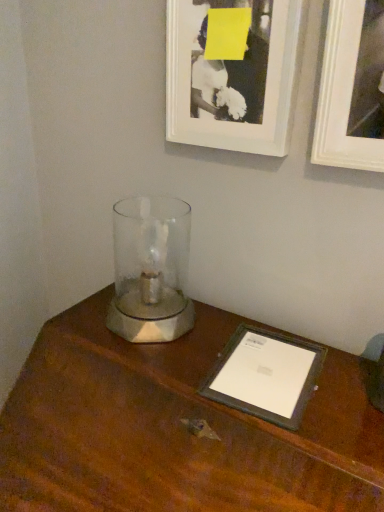
The height and width of the screenshot is (512, 384). I want to click on brown wood table at center, so click(176, 429).

I want to click on black matte picture frame at upper center, the 1th picture frame viewed from the left, so click(x=232, y=73).

Where is `brown wood table at center`? brown wood table at center is located at coordinates (176, 429).

From the image's perspective, which object appears higher, black matte picture frame at upper center, placed as the 2th picture frame when sorted from right to left, or brown wood table at center?

black matte picture frame at upper center, placed as the 2th picture frame when sorted from right to left, from the image's perspective.

Starting from the brown wood table at center, which picture frame is the 2nd one behind? Please provide its 2D coordinates.

[(232, 73)]

Considering their positions, is black matte picture frame at upper center, placed as the 2th picture frame when sorted from right to left, located in front of or behind brown wood table at center?

black matte picture frame at upper center, placed as the 2th picture frame when sorted from right to left, is positioned farther from the viewer than brown wood table at center.

Which of these two, white matte picture frame at upper right, acting as the 2th picture frame starting from the left, or black matte picture frame at upper center, the 1th picture frame viewed from the left, is smaller?

Smaller between the two is black matte picture frame at upper center, the 1th picture frame viewed from the left.

Is there a large distance between white matte picture frame at upper right, the 1th picture frame in the right-to-left sequence, and black matte picture frame at upper center, the 1th picture frame viewed from the left?

No, white matte picture frame at upper right, the 1th picture frame in the right-to-left sequence, is in close proximity to black matte picture frame at upper center, the 1th picture frame viewed from the left.

At what (x,y) coordinates should I click in order to perform the action: click on picture frame below the black matte picture frame at upper center, placed as the 2th picture frame when sorted from right to left (from the image's perspective). Please return your answer as a coordinate pair (x, y). This screenshot has height=512, width=384. Looking at the image, I should click on (351, 88).

Is brown wood table at center placed right next to white matte picture frame at upper right, acting as the 2th picture frame starting from the left?

No.

Can you confirm if brown wood table at center is positioned to the right of white matte picture frame at upper right, the 1th picture frame in the right-to-left sequence?

No, brown wood table at center is not to the right of white matte picture frame at upper right, the 1th picture frame in the right-to-left sequence.

How different are the orientations of brown wood table at center and white matte picture frame at upper right, the 1th picture frame in the right-to-left sequence, in degrees?

brown wood table at center and white matte picture frame at upper right, the 1th picture frame in the right-to-left sequence, are facing 3.24 degrees away from each other.

Where is `the 2nd picture frame to the right of the brown wood table at center, starting your count from the anchor`? The image size is (384, 512). the 2nd picture frame to the right of the brown wood table at center, starting your count from the anchor is located at coordinates (351, 88).

In terms of size, does white matte picture frame at upper right, acting as the 2th picture frame starting from the left, appear bigger or smaller than brown wood table at center?

Clearly, white matte picture frame at upper right, acting as the 2th picture frame starting from the left, is smaller in size than brown wood table at center.

Which is in front, white matte picture frame at upper right, the 1th picture frame in the right-to-left sequence, or brown wood table at center?

brown wood table at center.

You are a GUI agent. You are given a task and a screenshot of the screen. Output one action in this format:
    pyautogui.click(x=<x>, y=<y>)
    Task: Click on the picture frame in front of the black matte picture frame at upper center, the 1th picture frame viewed from the left
    The width and height of the screenshot is (384, 512).
    Given the screenshot: What is the action you would take?
    pyautogui.click(x=351, y=88)

From a real-world perspective, is black matte picture frame at upper center, placed as the 2th picture frame when sorted from right to left, located higher than white matte picture frame at upper right, the 1th picture frame in the right-to-left sequence?

No.

Who is more distant, black matte picture frame at upper center, placed as the 2th picture frame when sorted from right to left, or white matte picture frame at upper right, acting as the 2th picture frame starting from the left?

Positioned behind is black matte picture frame at upper center, placed as the 2th picture frame when sorted from right to left.

Between black matte picture frame at upper center, the 1th picture frame viewed from the left, and white matte picture frame at upper right, the 1th picture frame in the right-to-left sequence, which one has more height?

With more height is white matte picture frame at upper right, the 1th picture frame in the right-to-left sequence.

Is brown wood table at center bigger than black matte picture frame at upper center, the 1th picture frame viewed from the left?

Correct, brown wood table at center is larger in size than black matte picture frame at upper center, the 1th picture frame viewed from the left.

Between brown wood table at center and black matte picture frame at upper center, the 1th picture frame viewed from the left, which one has more height?

brown wood table at center.

Considering the sizes of objects brown wood table at center and black matte picture frame at upper center, the 1th picture frame viewed from the left, in the image provided, who is wider, brown wood table at center or black matte picture frame at upper center, the 1th picture frame viewed from the left,?

brown wood table at center.

Which object is closer to the camera taking this photo, brown wood table at center or black matte picture frame at upper center, placed as the 2th picture frame when sorted from right to left?

brown wood table at center is more forward.

The image size is (384, 512). Find the location of `table in front of the black matte picture frame at upper center, placed as the 2th picture frame when sorted from right to left`. table in front of the black matte picture frame at upper center, placed as the 2th picture frame when sorted from right to left is located at coordinates (176, 429).

Identify the location of picture frame that appears below the black matte picture frame at upper center, the 1th picture frame viewed from the left (from the image's perspective). (351, 88).

From the picture: Looking at the image, which one is located further to brown wood table at center, black matte picture frame at upper center, placed as the 2th picture frame when sorted from right to left, or white matte picture frame at upper right, acting as the 2th picture frame starting from the left?

Based on the image, white matte picture frame at upper right, acting as the 2th picture frame starting from the left, appears to be further to brown wood table at center.

From the image, which object appears to be nearer to black matte picture frame at upper center, placed as the 2th picture frame when sorted from right to left, brown wood table at center or white matte picture frame at upper right, acting as the 2th picture frame starting from the left?

white matte picture frame at upper right, acting as the 2th picture frame starting from the left, is positioned closer to the anchor black matte picture frame at upper center, placed as the 2th picture frame when sorted from right to left.

Based on their spatial positions, is white matte picture frame at upper right, the 1th picture frame in the right-to-left sequence, or brown wood table at center further from black matte picture frame at upper center, placed as the 2th picture frame when sorted from right to left?

brown wood table at center.

Which object lies further to the anchor point white matte picture frame at upper right, acting as the 2th picture frame starting from the left, black matte picture frame at upper center, placed as the 2th picture frame when sorted from right to left, or brown wood table at center?

Among the two, brown wood table at center is located further to white matte picture frame at upper right, acting as the 2th picture frame starting from the left.

Considering their positions, is brown wood table at center positioned closer to white matte picture frame at upper right, the 1th picture frame in the right-to-left sequence, than black matte picture frame at upper center, placed as the 2th picture frame when sorted from right to left?

black matte picture frame at upper center, placed as the 2th picture frame when sorted from right to left, lies closer to white matte picture frame at upper right, the 1th picture frame in the right-to-left sequence, than the other object.

Looking at the image, which one is located closer to brown wood table at center, white matte picture frame at upper right, the 1th picture frame in the right-to-left sequence, or black matte picture frame at upper center, placed as the 2th picture frame when sorted from right to left?

The object closer to brown wood table at center is black matte picture frame at upper center, placed as the 2th picture frame when sorted from right to left.

This screenshot has height=512, width=384. Identify the location of picture frame between black matte picture frame at upper center, placed as the 2th picture frame when sorted from right to left, and brown wood table at center, in the vertical direction. pyautogui.click(x=351, y=88).